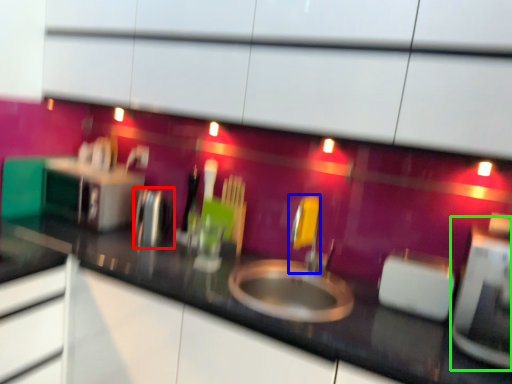
Question: Which object is positioned farthest from appliance (highlighted by a red box)? Select from faucet (highlighted by a blue box) and appliance (highlighted by a green box).

Choices:
 (A) faucet
 (B) appliance

Answer: (B)